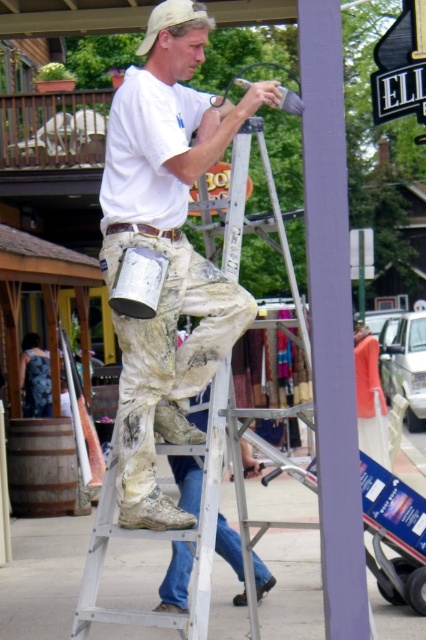
Question: Does silver metallic ladder at center have a greater width compared to wooden barrel at lower left?

Choices:
 (A) no
 (B) yes

Answer: (A)

Question: Which point appears farthest from the camera in this image?

Choices:
 (A) (264, 164)
 (B) (74, 454)

Answer: (B)

Question: Observing the image, what is the correct spatial positioning of silver metallic ladder at center in reference to wooden barrel at lower left?

Choices:
 (A) below
 (B) above

Answer: (B)

Question: Among these objects, which one is farthest from the camera?

Choices:
 (A) wooden barrel at lower left
 (B) silver metallic ladder at center

Answer: (A)

Question: Is silver metallic ladder at center below wooden barrel at lower left?

Choices:
 (A) no
 (B) yes

Answer: (A)